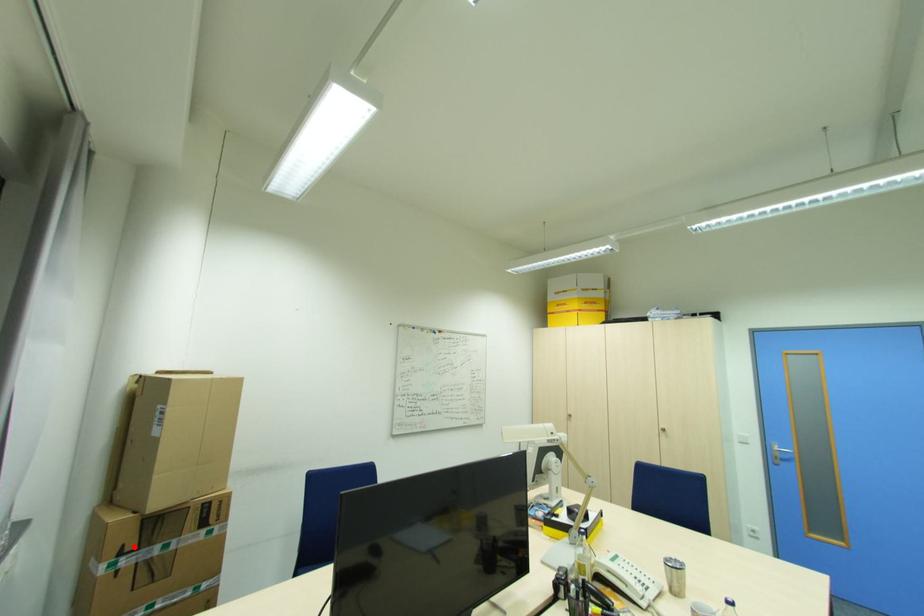
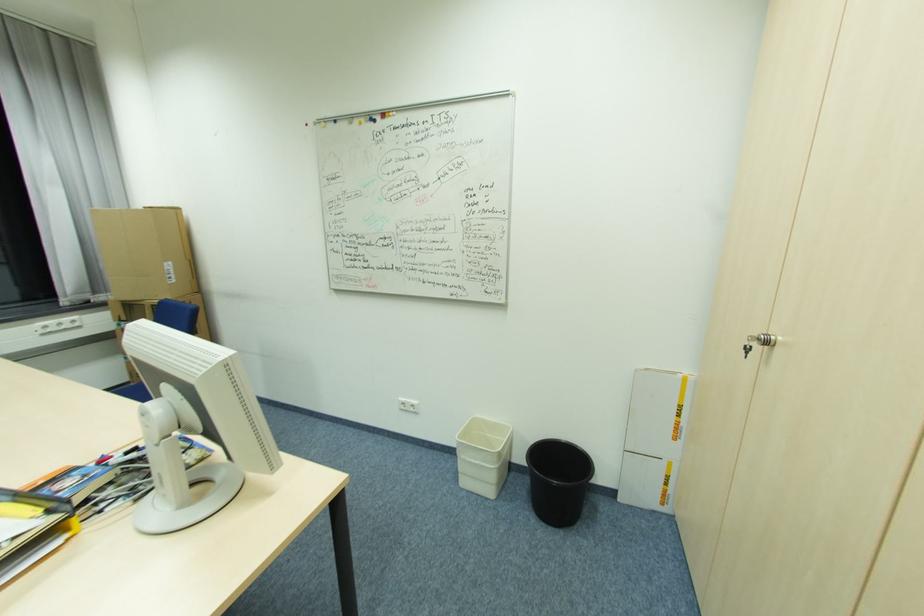
Where in the second image is the point corresponding to the highlighted location from the first image?

(127, 318)